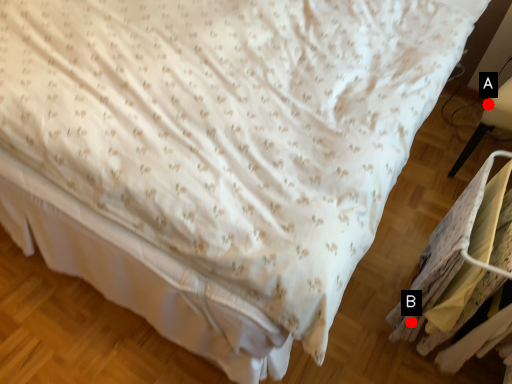
Question: Two points are circled on the image, labeled by A and B beside each circle. Among these points, which one is nearest to the camera?

Choices:
 (A) A is closer
 (B) B is closer

Answer: (B)